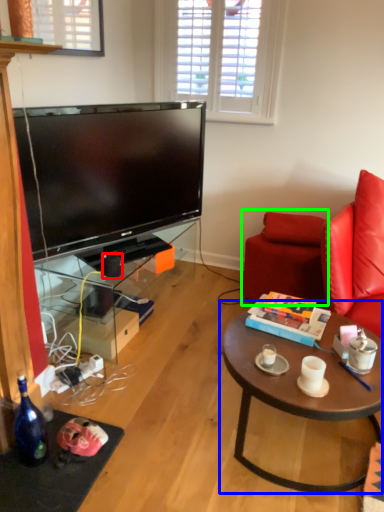
Question: Which object is positioned closest to speaker (highlighted by a red box)? Select from coffee table (highlighted by a blue box) and swivel chair (highlighted by a green box).

Choices:
 (A) coffee table
 (B) swivel chair

Answer: (B)